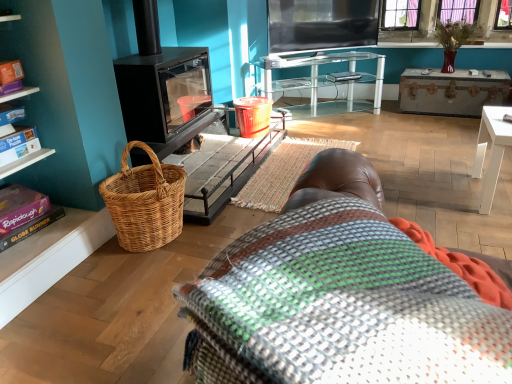
Locate an element on the screen. The height and width of the screenshot is (384, 512). empty space that is to the right of multicolored woven blanket at center is located at coordinates (411, 170).